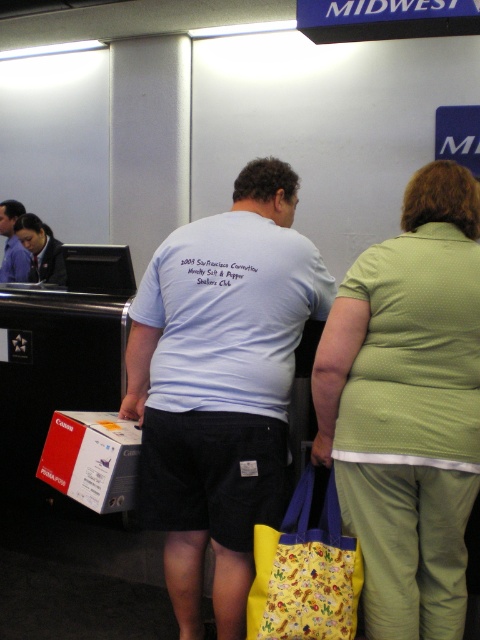
Question: Which point appears closest to the camera in this image?

Choices:
 (A) (348, 588)
 (B) (280, 474)
 (C) (32, 280)

Answer: (A)

Question: Estimate the real-world distances between objects in this image. Which object is farther from the green dotted shirt at center?

Choices:
 (A) blue cotton shirt at center
 (B) matte black uniform at left
 (C) white cotton t-shirt at center

Answer: (A)

Question: Considering the relative positions of green dotted shirt at center and yellow fabric bag at lower center in the image provided, where is green dotted shirt at center located with respect to yellow fabric bag at lower center?

Choices:
 (A) right
 (B) left

Answer: (A)

Question: Where is white cotton t-shirt at center located in relation to yellow fabric bag at lower center in the image?

Choices:
 (A) left
 (B) right

Answer: (A)

Question: Does white cotton t-shirt at center come in front of green dotted shirt at center?

Choices:
 (A) yes
 (B) no

Answer: (B)

Question: Which is nearer to the white cotton t-shirt at center?

Choices:
 (A) green dotted shirt at center
 (B) blue cotton shirt at center

Answer: (A)